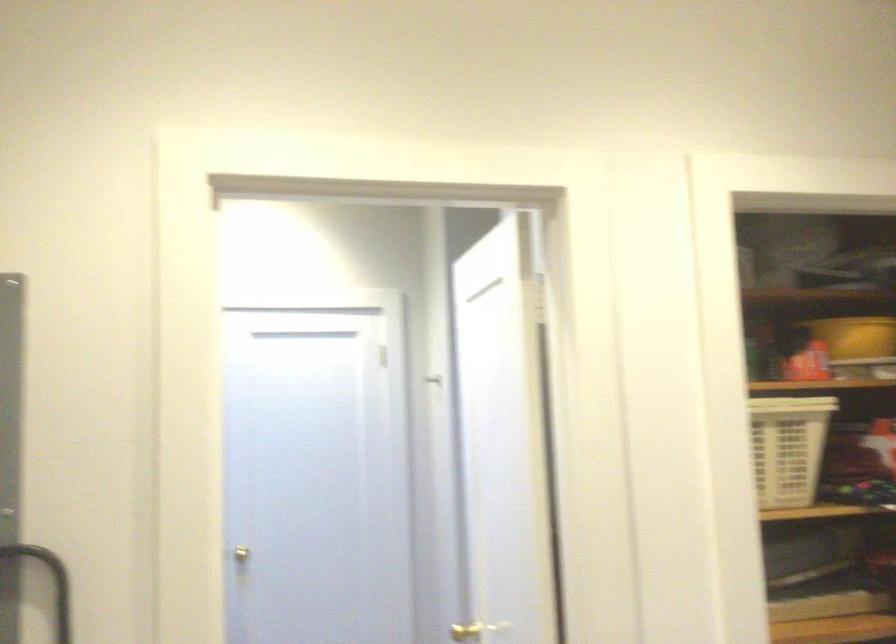
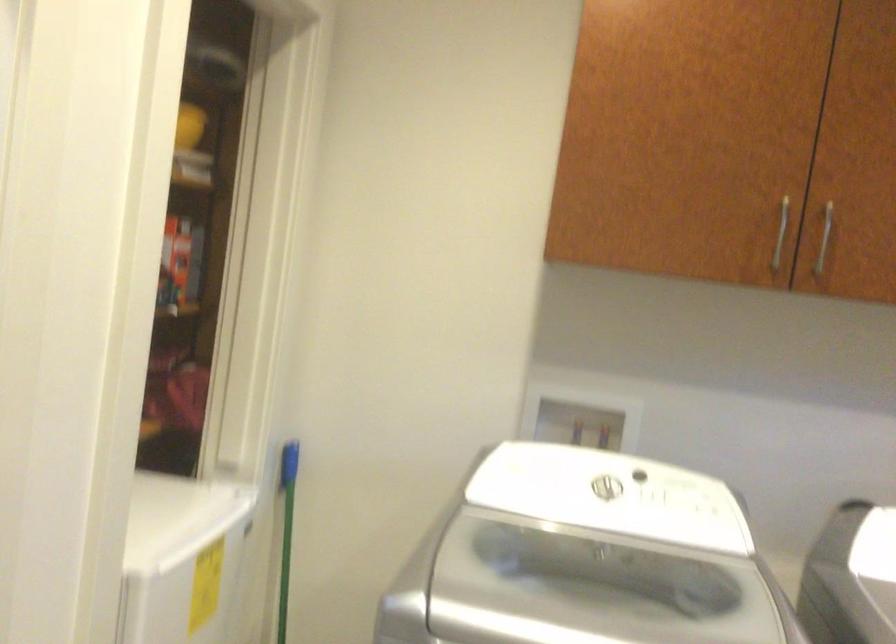
Question: I am providing you with two images of the same scene from different viewpoints. Please identify which objects are invisible in image2.

Choices:
 (A) silver cabinet handle
 (B) white laundry basket
 (C) green broom handle
 (D) blue tangled cable

Answer: (B)